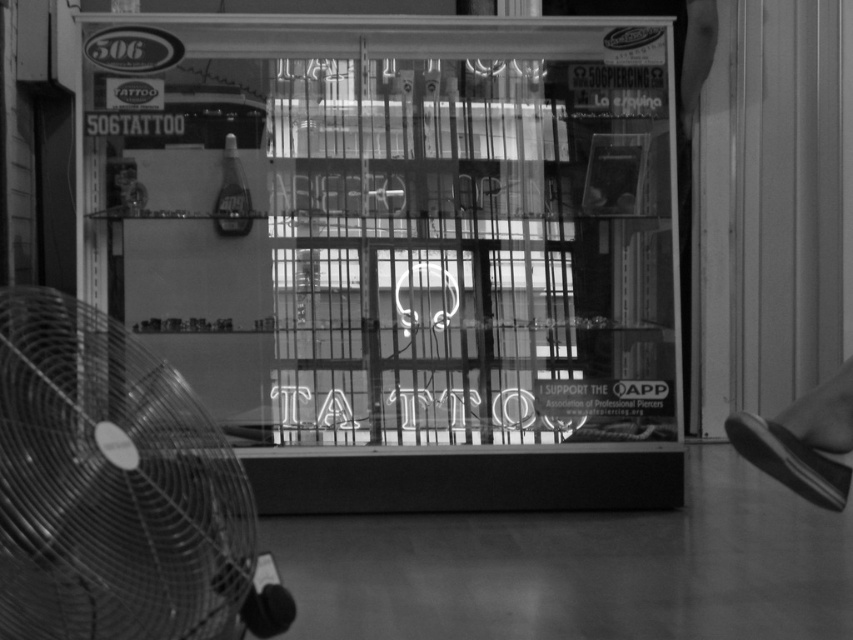
You are a customer standing in front of the 506 Tattoo store. You notice the neon sign tattoo at center and the metallic fan at left. Which object is closer to you?

The neon sign tattoo at center is closer to you than the metallic fan at left because it is further to the viewer.

You are standing in front of the tattoo parlor and want to take a photo of the neon sign tattoo at center without the metallic fan at left appearing in the shot. Since you can only move sideways, how far to the right do you need to move from your current position to ensure the fan is out of frame? Assume your camera has a 50mm lens and a full frame sensor.

To determine the required distance, first calculate the angle of view using the lens formula. With a 50mm lens on a full frame sensor, the horizontal angle of view is approximately 39.6 degrees. The distance between the neon sign tattoo at center and the metallic fan at left is 9.44 feet. Using trigonometry, the tangent of half the angle of view equals half the distance between the objects divided by the distance from the camera to the objects. Solving for the required distance, you would need to move at a

You are a customer standing outside the tattoo parlor and want to enter. The entrance is on the right side of the neon sign tattoo at center. To reach the entrance, should you walk around the metallic fan at left to your left or to your right?

The neon sign tattoo at center is positioned on the right side of the metallic fan at left, so the entrance is on the right side of the neon sign tattoo at center. To reach the entrance, you should walk around the metallic fan at left to your right.